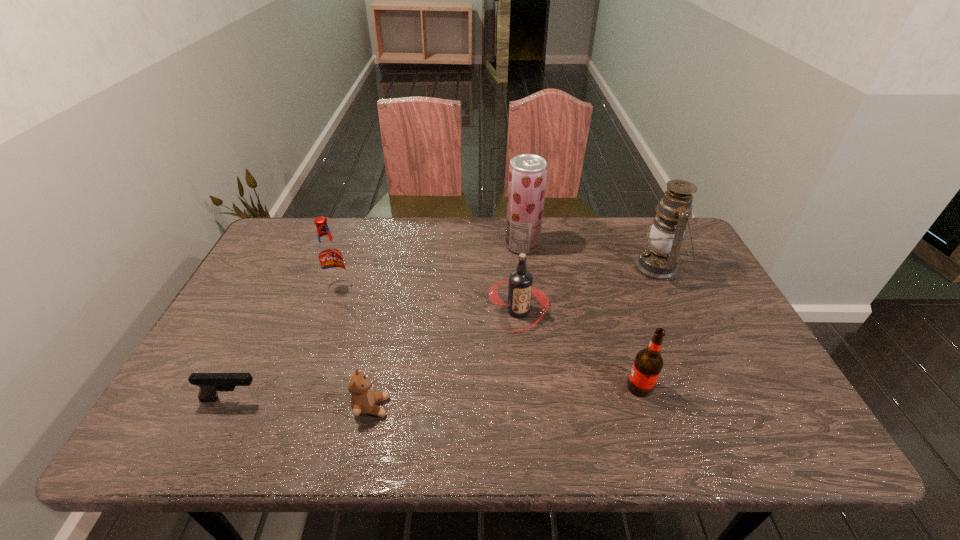
What are the coordinates of `empty space that is in between the pistol and the fifth object from right to left` in the screenshot? It's located at click(301, 403).

Locate an element on the screen. The height and width of the screenshot is (540, 960). empty space between the second object from left to right and the pistol is located at coordinates [x=285, y=343].

The width and height of the screenshot is (960, 540). In order to click on vacant area that lies between the teddy bear and the leftmost object in this screenshot , I will do `click(301, 403)`.

Identify the location of free space between the shortest object and the rightmost object. (444, 334).

The image size is (960, 540). Find the location of `unoccupied position between the tallest root beer and the rightmost object`. unoccupied position between the tallest root beer and the rightmost object is located at coordinates (498, 277).

I want to click on free point between the third tallest object and the pistol, so click(x=285, y=343).

Locate an element on the screen. free area in between the fruit juice and the sixth object from right to left is located at coordinates (430, 266).

Find the location of a particular element. This screenshot has height=540, width=960. empty space that is in between the rightmost root beer and the rightmost object is located at coordinates (649, 327).

Identify the location of blank region between the nearest root beer and the tallest root beer. (489, 337).

I want to click on the closest object to the rightmost object, so click(x=527, y=178).